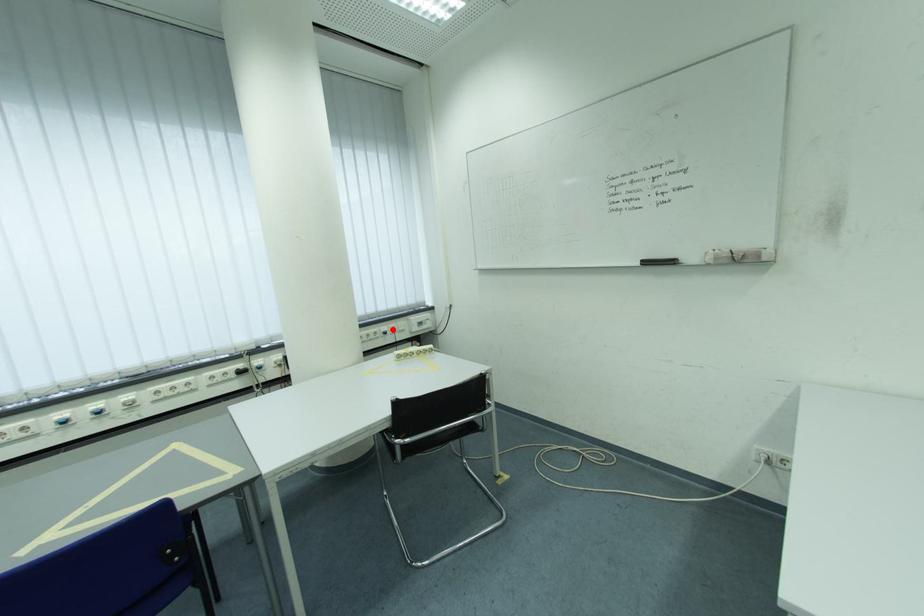
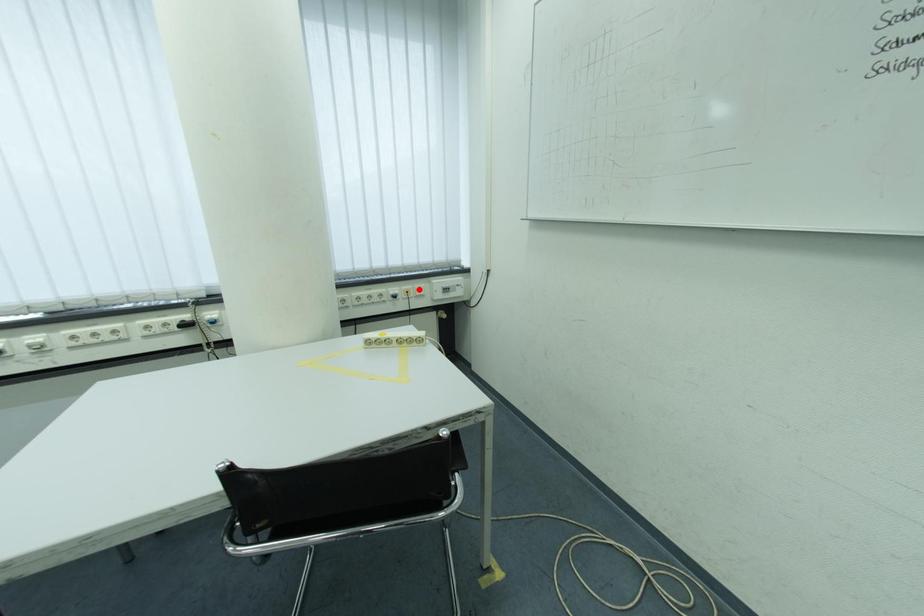
I am providing you with two images of the same scene from different viewpoints. A red point is marked on the first image and another point is marked on the second image. Is the marked point in image1 the same physical position as the marked point in image2?

No